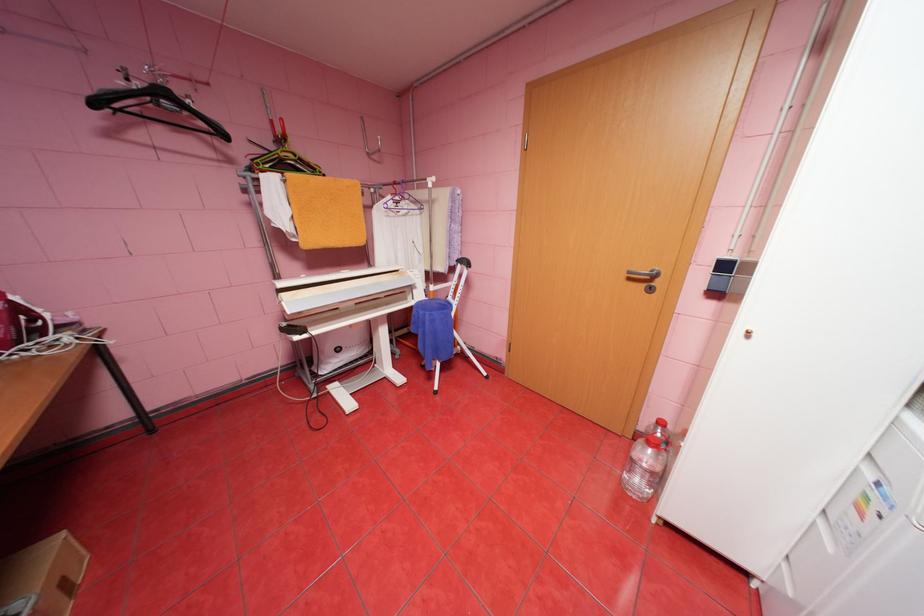
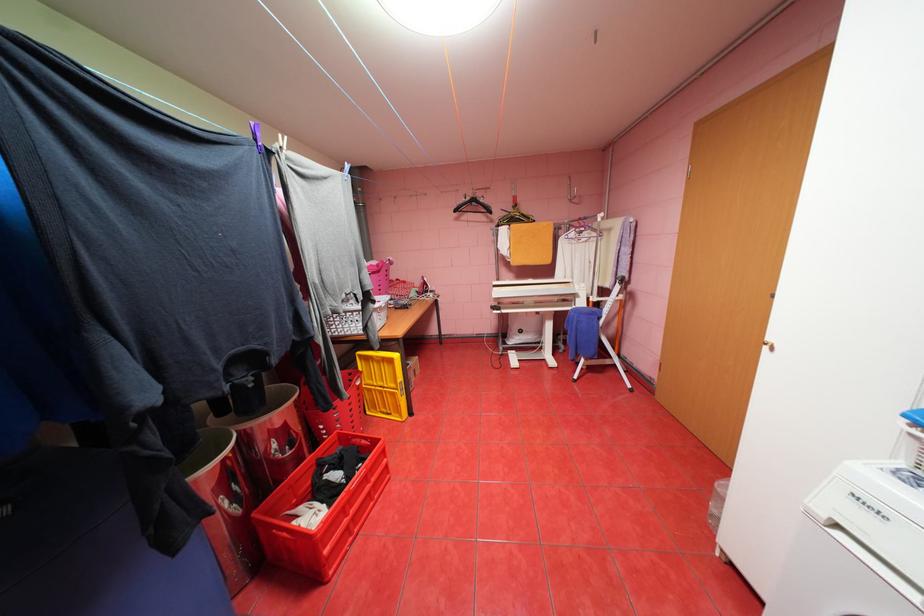
In the second image, find the point that corresponds to point (103, 103) in the first image.

(464, 209)